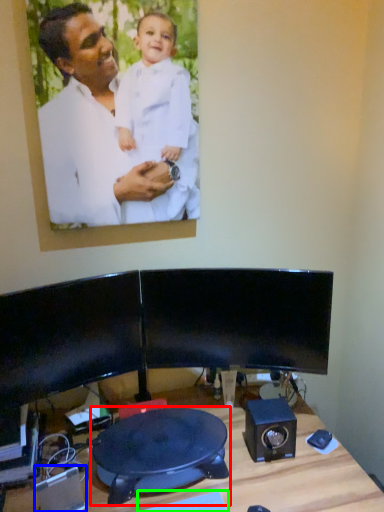
Question: Which object is positioned closest to swivel chair (highlighted by a red box)? Select from speaker (highlighted by a blue box) and keyboard (highlighted by a green box).

Choices:
 (A) speaker
 (B) keyboard

Answer: (B)